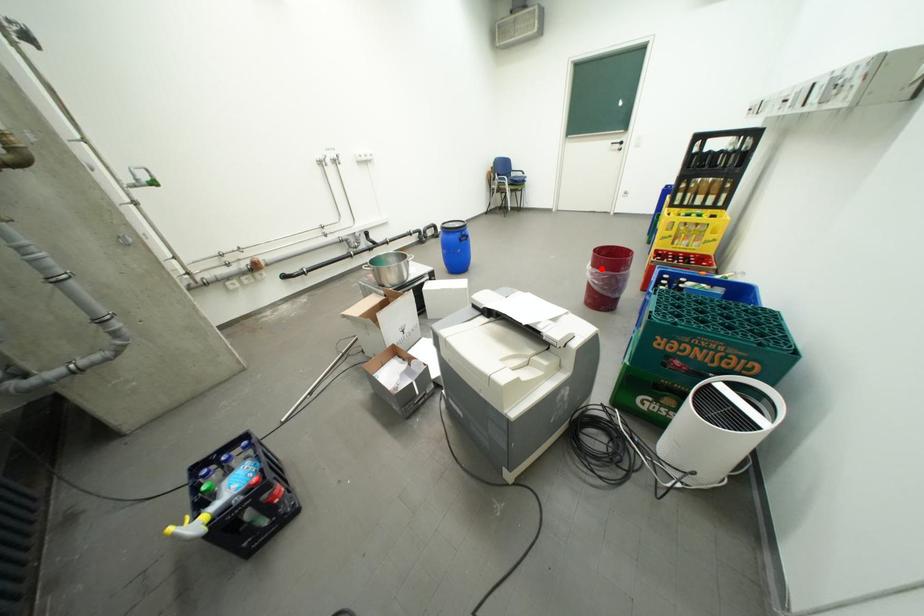
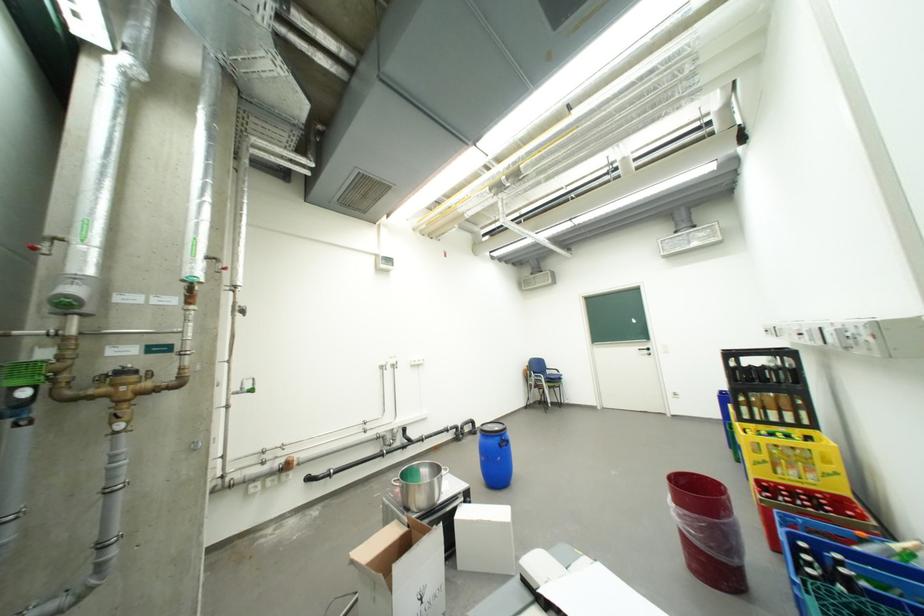
Locate, in the second image, the point that corresponds to the highlighted location in the first image.

(685, 507)